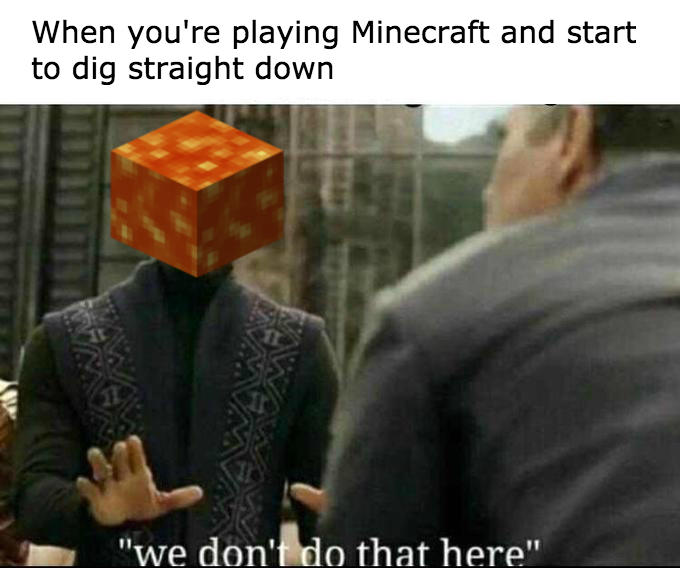
You are a GUI agent. You are given a task and a screenshot of the screen. Output one action in this format:
    pyautogui.click(x=<x>, y=<y>)
    Task: Click on the back wall
    This screenshot has height=568, width=680.
    Given the screenshot: What is the action you would take?
    pyautogui.click(x=48, y=204), pyautogui.click(x=350, y=275)